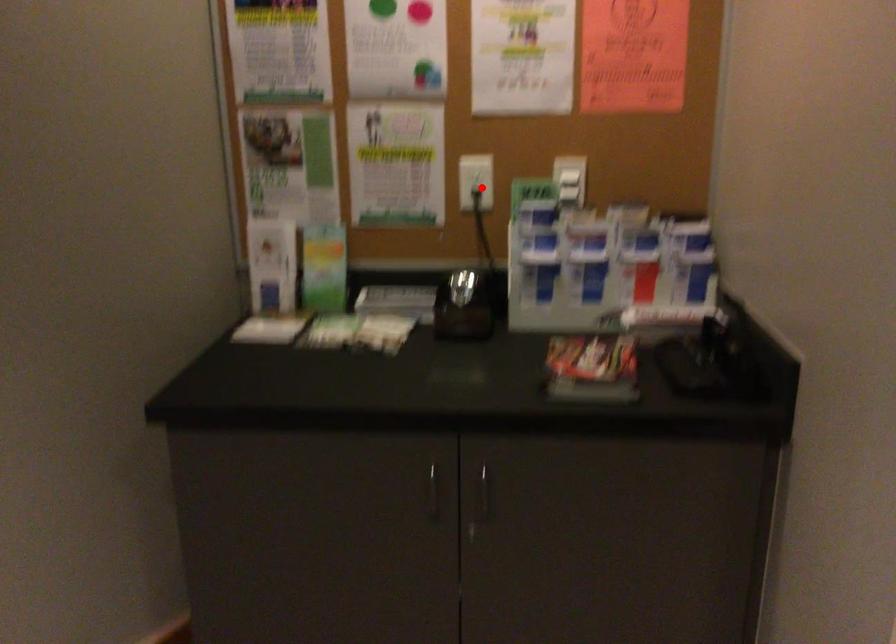
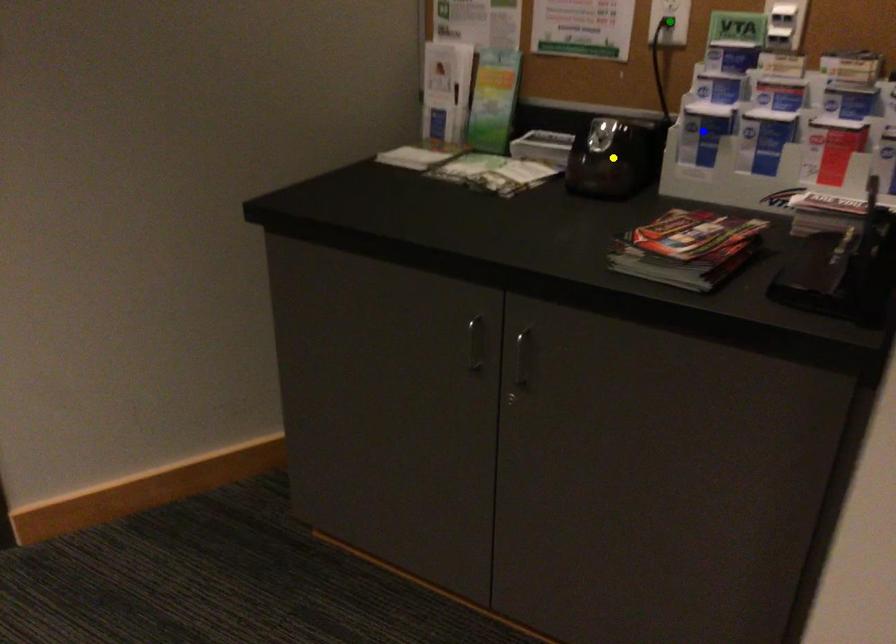
Question: I am providing you with two images of the same scene from different viewpoints. A red point is marked on the first image. You are given multiple points on the second image. Which point in image 2 is actually the same real-world point as the red point in image 1?

Choices:
 (A) green point
 (B) blue point
 (C) yellow point

Answer: (A)